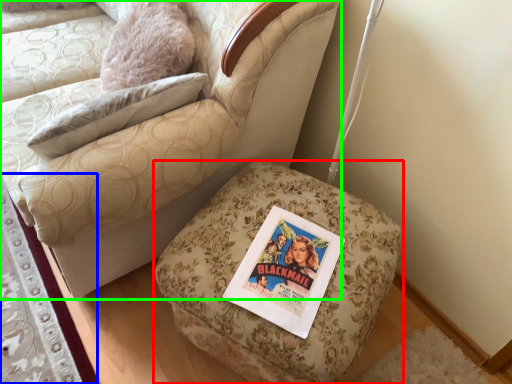
Question: Which is farther away from furniture (highlighted by a red box)? mat (highlighted by a blue box) or chair (highlighted by a green box)?

Choices:
 (A) mat
 (B) chair

Answer: (A)